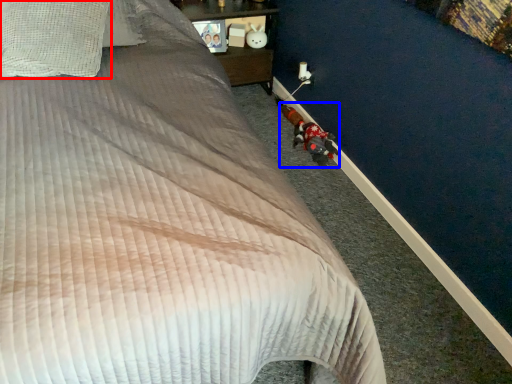
Question: Which point is closer to the camera, pillow (highlighted by a red box) or toy (highlighted by a blue box)?

Choices:
 (A) pillow
 (B) toy

Answer: (A)